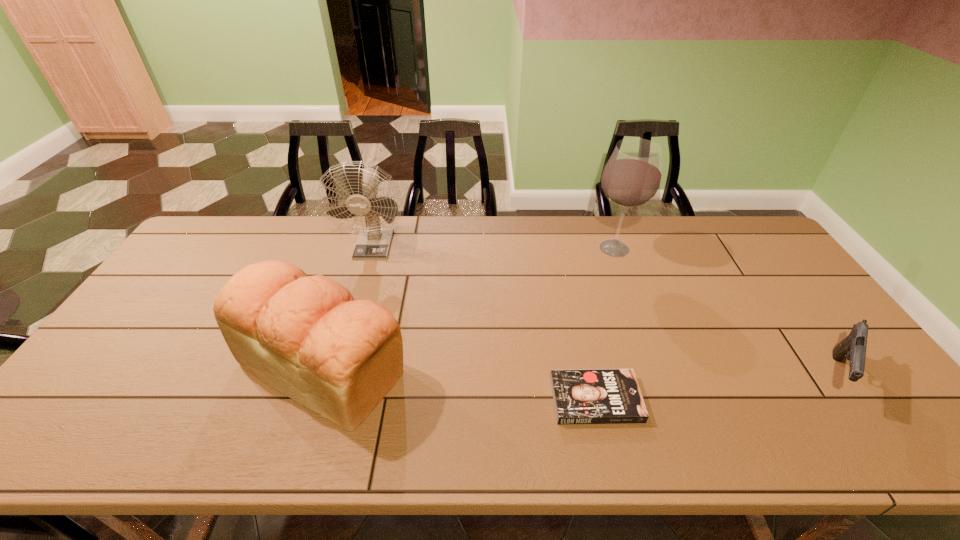
Where is `vacant space located 0.200m on the back of the shortest object`? The image size is (960, 540). vacant space located 0.200m on the back of the shortest object is located at coordinates (577, 317).

The image size is (960, 540). Find the location of `alcohol located in the far edge section of the desktop`. alcohol located in the far edge section of the desktop is located at coordinates (632, 177).

Find the location of a particular element. fan that is at the far edge is located at coordinates (373, 242).

Where is `bread that is at the near edge`? bread that is at the near edge is located at coordinates (305, 336).

I want to click on book present at the near edge, so click(582, 396).

The image size is (960, 540). In order to click on object present at the right edge in this screenshot , I will do `click(853, 347)`.

Locate an element on the screen. vacant space at the far edge of the desktop is located at coordinates (400, 224).

Find the location of a particular element. vacant region at the left edge of the desktop is located at coordinates coord(216,261).

In the image, there is a desktop. Identify the location of vacant space at the right edge. Image resolution: width=960 pixels, height=540 pixels. (756, 270).

The image size is (960, 540). In the image, there is a desktop. Find the location of `vacant region at the near right corner`. vacant region at the near right corner is located at coordinates (873, 428).